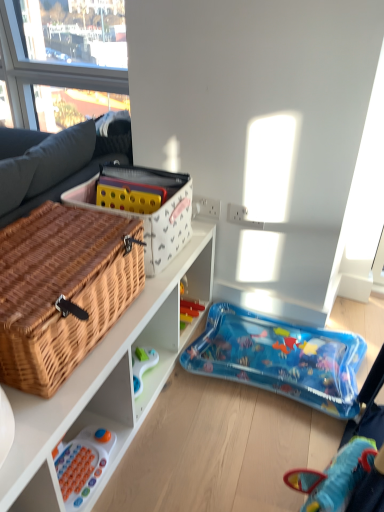
Describe the element at coordinates (144, 208) in the screenshot. This screenshot has width=384, height=512. I see `white fabric storage box at upper center` at that location.

What do you see at coordinates (280, 358) in the screenshot?
I see `blue inflatable pool at lower right, which is the 1th toy in right-to-left order` at bounding box center [280, 358].

The image size is (384, 512). What do you see at coordinates (62, 290) in the screenshot?
I see `woven brown picnic basket at left` at bounding box center [62, 290].

In order to click on white fabric storage box at upper center in this screenshot , I will do `click(144, 208)`.

Is woven wood cabinet at lower left shorter than blue inflatable pool at lower right, the second toy in the front-to-back sequence?

Yes.

In the scene shown: Which of these two, woven wood cabinet at lower left or blue inflatable pool at lower right, which appears as the second toy when viewed from the left, is smaller?

With smaller size is blue inflatable pool at lower right, which appears as the second toy when viewed from the left.

In the scene shown: Is woven wood cabinet at lower left outside of blue inflatable pool at lower right, the first toy when ordered from top to bottom?

woven wood cabinet at lower left is positioned outside blue inflatable pool at lower right, the first toy when ordered from top to bottom.

In the image, is woven wood cabinet at lower left on the left side or the right side of blue inflatable pool at lower right, the second toy in the front-to-back sequence?

woven wood cabinet at lower left is to the left of blue inflatable pool at lower right, the second toy in the front-to-back sequence.

Is woven wood cabinet at lower left turned away from white plastic toy at lower left, which appears as the 2th toy when viewed from the right?

woven wood cabinet at lower left does not have its back to white plastic toy at lower left, which appears as the 2th toy when viewed from the right.

Considering the sizes of woven wood cabinet at lower left and white plastic toy at lower left, which ranks as the 2th toy in top-to-bottom order, in the image, is woven wood cabinet at lower left wider or thinner than white plastic toy at lower left, which ranks as the 2th toy in top-to-bottom order,?

Clearly, woven wood cabinet at lower left has more width compared to white plastic toy at lower left, which ranks as the 2th toy in top-to-bottom order.

Considering the points (202, 287) and (113, 442), which point is behind, point (202, 287) or point (113, 442)?

The point (202, 287) is behind.

Do you think woven wood cabinet at lower left is within white plastic toy at lower left, the second toy from the back, or outside of it?

woven wood cabinet at lower left is not enclosed by white plastic toy at lower left, the second toy from the back.

Does blue inflatable pool at lower right, the first toy when ordered from top to bottom, have a larger size compared to woven wood cabinet at lower left?

No.

Is point (350, 361) positioned behind point (118, 415)?

Yes.

Looking at this image, which object is closer to the camera, blue inflatable pool at lower right, the second toy in the front-to-back sequence, or woven wood cabinet at lower left?

woven wood cabinet at lower left is more forward.

From a real-world perspective, which object stands above the other?

woven brown picnic basket at left, from a real-world perspective.

Is white plastic toy at lower left, acting as the 1th toy starting from the left, wider or thinner than woven brown picnic basket at left?

In the image, white plastic toy at lower left, acting as the 1th toy starting from the left, appears to be more narrow than woven brown picnic basket at left.

In terms of height, does white plastic toy at lower left, acting as the 1th toy starting from the left, look taller or shorter compared to woven brown picnic basket at left?

white plastic toy at lower left, acting as the 1th toy starting from the left, is shorter than woven brown picnic basket at left.

Is white plastic toy at lower left, acting as the 1th toy starting from the left, directly adjacent to woven brown picnic basket at left?

No, white plastic toy at lower left, acting as the 1th toy starting from the left, is not with woven brown picnic basket at left.

From a real-world perspective, is woven brown picnic basket at left positioned above or below white fabric storage box at upper center?

woven brown picnic basket at left is below white fabric storage box at upper center.

Could you tell me if woven brown picnic basket at left is facing white fabric storage box at upper center?

No, woven brown picnic basket at left is not turned towards white fabric storage box at upper center.

How different are the orientations of woven brown picnic basket at left and white fabric storage box at upper center in degrees?

They differ by 0.00486 degrees in their facing directions.

Can you confirm if woven brown picnic basket at left is taller than white fabric storage box at upper center?

In fact, woven brown picnic basket at left may be shorter than white fabric storage box at upper center.

From a real-world perspective, which is physically below, white plastic toy at lower left, the 1th toy positioned from the bottom, or blue inflatable pool at lower right, which appears as the second toy when viewed from the left?

From a 3D spatial view, blue inflatable pool at lower right, which appears as the second toy when viewed from the left, is below.

From the image's perspective, relative to blue inflatable pool at lower right, which appears as the second toy when viewed from the left, is white plastic toy at lower left, the second toy from the back, above or below?

white plastic toy at lower left, the second toy from the back, is situated lower than blue inflatable pool at lower right, which appears as the second toy when viewed from the left, in the image.

Considering their positions, is white plastic toy at lower left, which appears as the 2th toy when viewed from the right, located in front of or behind blue inflatable pool at lower right, which appears as the second toy when viewed from the left?

white plastic toy at lower left, which appears as the 2th toy when viewed from the right, is positioned closer to the viewer than blue inflatable pool at lower right, which appears as the second toy when viewed from the left.

Based on the photo, can you confirm if white plastic toy at lower left, which ranks as the 2th toy in top-to-bottom order, is bigger than blue inflatable pool at lower right, which is the 2th toy in bottom-to-top order?

Incorrect, white plastic toy at lower left, which ranks as the 2th toy in top-to-bottom order, is not larger than blue inflatable pool at lower right, which is the 2th toy in bottom-to-top order.

Is blue inflatable pool at lower right, which is the 2th toy in bottom-to-top order, to the right of woven brown picnic basket at left from the viewer's perspective?

Indeed, blue inflatable pool at lower right, which is the 2th toy in bottom-to-top order, is positioned on the right side of woven brown picnic basket at left.

Is blue inflatable pool at lower right, which is the 1th toy in right-to-left order, turned away from woven brown picnic basket at left?

blue inflatable pool at lower right, which is the 1th toy in right-to-left order, does not have its back to woven brown picnic basket at left.

Is blue inflatable pool at lower right, which is the 1th toy in right-to-left order, touching woven brown picnic basket at left?

They are not placed beside each other.

What's the angular difference between blue inflatable pool at lower right, which appears as the second toy when viewed from the left, and woven brown picnic basket at left's facing directions?

The angular difference between blue inflatable pool at lower right, which appears as the second toy when viewed from the left, and woven brown picnic basket at left is 0.263 degrees.

I want to click on toy above the woven wood cabinet at lower left (from the image's perspective), so click(280, 358).

In order to click on toy lying below the woven wood cabinet at lower left (from the image's perspective) in this screenshot , I will do `click(82, 465)`.

Looking at the image, which one is located further to white fabric storage box at upper center, blue inflatable pool at lower right, the second toy in the front-to-back sequence, or woven wood cabinet at lower left?

blue inflatable pool at lower right, the second toy in the front-to-back sequence, is further to white fabric storage box at upper center.

Looking at this image, looking at the image, which one is located further to blue inflatable pool at lower right, the second toy in the front-to-back sequence, woven wood cabinet at lower left or white plastic toy at lower left, acting as the 1th toy starting from the left?

Based on the image, white plastic toy at lower left, acting as the 1th toy starting from the left, appears to be further to blue inflatable pool at lower right, the second toy in the front-to-back sequence.

Based on their spatial positions, is white fabric storage box at upper center or woven brown picnic basket at left closer to woven wood cabinet at lower left?

woven brown picnic basket at left lies closer to woven wood cabinet at lower left than the other object.

Based on their spatial positions, is woven wood cabinet at lower left or blue inflatable pool at lower right, which appears as the second toy when viewed from the left, closer to white plastic toy at lower left, which ranks as the 2th toy in top-to-bottom order?

Based on the image, woven wood cabinet at lower left appears to be nearer to white plastic toy at lower left, which ranks as the 2th toy in top-to-bottom order.

Considering their positions, is white plastic toy at lower left, which is the 1th toy from front to back, positioned further to woven brown picnic basket at left than woven wood cabinet at lower left?

The object further to woven brown picnic basket at left is white plastic toy at lower left, which is the 1th toy from front to back.

Estimate the real-world distances between objects in this image. Which object is further from blue inflatable pool at lower right, which is the 2th toy in bottom-to-top order, woven wood cabinet at lower left or white fabric storage box at upper center?

white fabric storage box at upper center lies further to blue inflatable pool at lower right, which is the 2th toy in bottom-to-top order, than the other object.

Which object lies further to the anchor point woven brown picnic basket at left, blue inflatable pool at lower right, which is the 2th toy in bottom-to-top order, or white plastic toy at lower left, which is the 1th toy from front to back?

The object further to woven brown picnic basket at left is blue inflatable pool at lower right, which is the 2th toy in bottom-to-top order.

Considering their positions, is white fabric storage box at upper center positioned closer to woven wood cabinet at lower left than blue inflatable pool at lower right, which is the 1th toy in right-to-left order?

Among the two, white fabric storage box at upper center is located nearer to woven wood cabinet at lower left.

The image size is (384, 512). Find the location of `cabinetry between white plastic toy at lower left, the second toy from the back, and blue inflatable pool at lower right, which is the 2th toy in bottom-to-top order`. cabinetry between white plastic toy at lower left, the second toy from the back, and blue inflatable pool at lower right, which is the 2th toy in bottom-to-top order is located at coordinates (106, 383).

Locate an element on the screen. Image resolution: width=384 pixels, height=512 pixels. cardboard box located between woven brown picnic basket at left and woven wood cabinet at lower left in the left-right direction is located at coordinates (144, 208).

This screenshot has height=512, width=384. What are the coordinates of `toy between white fabric storage box at upper center and woven wood cabinet at lower left vertically` in the screenshot? It's located at (280, 358).

The width and height of the screenshot is (384, 512). Find the location of `cabinetry located between woven brown picnic basket at left and blue inflatable pool at lower right, the second toy in the front-to-back sequence, in the left-right direction`. cabinetry located between woven brown picnic basket at left and blue inflatable pool at lower right, the second toy in the front-to-back sequence, in the left-right direction is located at coordinates (106, 383).